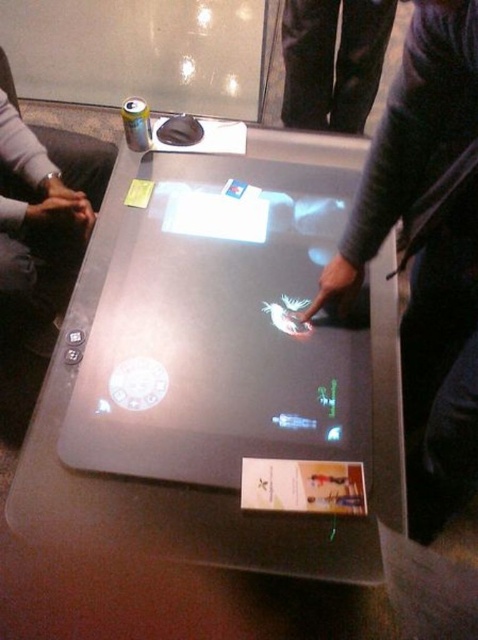
In the scene shown: You are organizing a game night and need to place a new game box on the table. The table has the black jeans at upper center and the white matte card game at center. Which object should you move to make space, and why?

You should move the black jeans at upper center because it is bigger than the white matte card game at center, so moving the larger object will free up more space.

You are a game developer testing a new interactive table game. You need to ensure that the matte black laptop at center and the white matte card game at center are positioned correctly. According to the design specifications, the minimum required distance between them should be 12 inches to prevent interference. Is the current setup compliant with the specifications?

The distance between the matte black laptop at center and the white matte card game at center is 11.87 inches, which is less than the required 12 inches. Therefore, the current setup does not comply with the specifications.